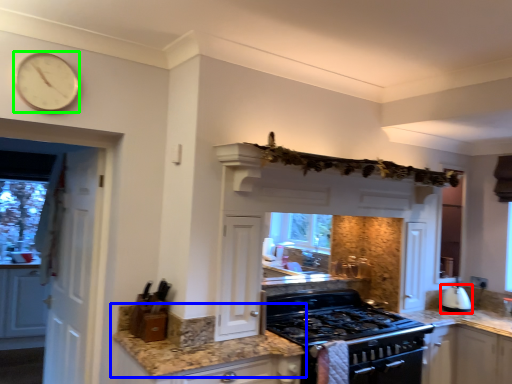
Question: Estimate the real-world distances between objects in this image. Which object is closer to kitchen appliance (highlighted by a red box), countertop (highlighted by a blue box) or clock (highlighted by a green box)?

Choices:
 (A) countertop
 (B) clock

Answer: (A)